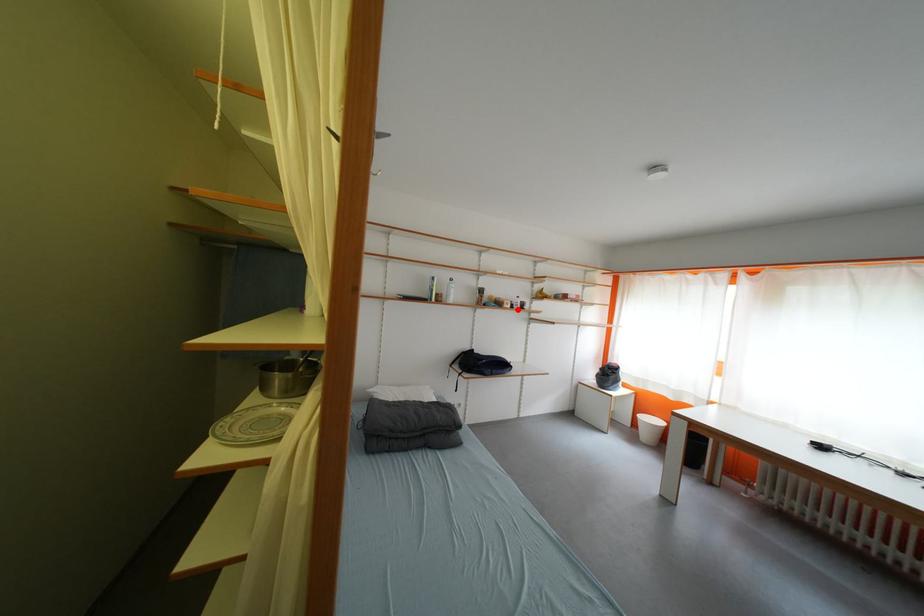
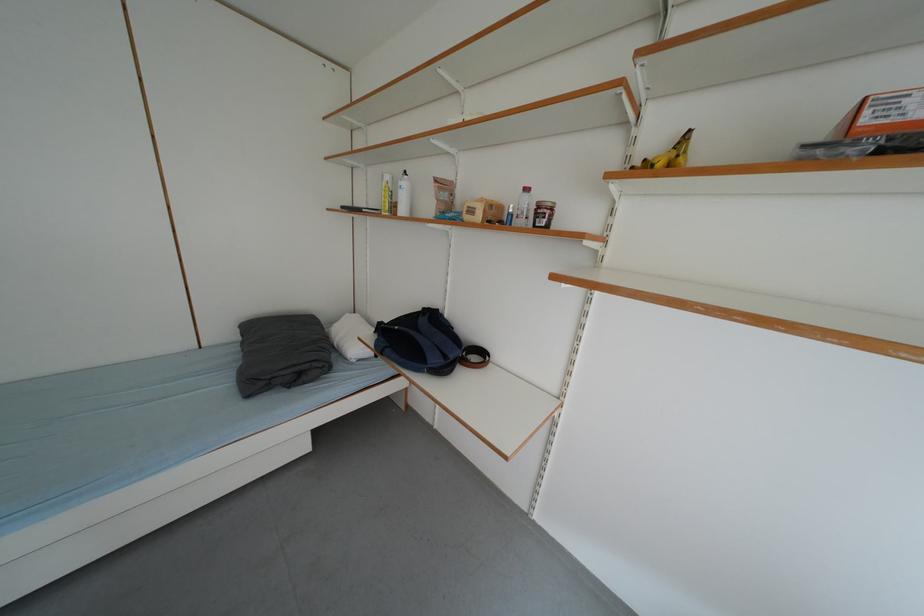
In the second image, find the point that corresponds to the highlighted location in the first image.

(487, 220)